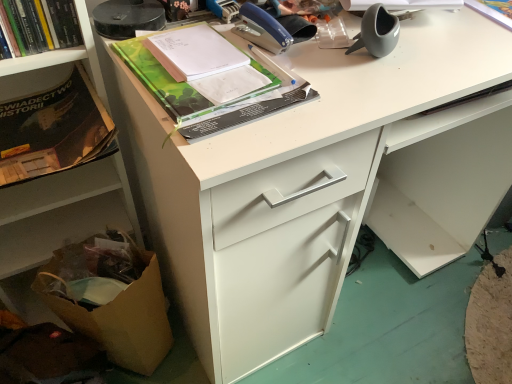
The width and height of the screenshot is (512, 384). Describe the element at coordinates (42, 24) in the screenshot. I see `hardcover book at upper left, which is the 1th book in left-to-right order` at that location.

This screenshot has width=512, height=384. What are the coordinates of `matte black book at left` in the screenshot? It's located at (54, 130).

What do you see at coordinates (203, 96) in the screenshot? This screenshot has width=512, height=384. I see `green matte book at upper center, acting as the 2th book starting from the right` at bounding box center [203, 96].

The width and height of the screenshot is (512, 384). In order to click on matte gray vase at upper right, the 1th office supplies positioned from the right in this screenshot , I will do `click(377, 32)`.

Describe the element at coordinates (110, 299) in the screenshot. This screenshot has width=512, height=384. I see `brown paper bag at lower left` at that location.

The height and width of the screenshot is (384, 512). Identify the location of brown cardboard box at lower left. (63, 212).

Measure the distance between white paper at upper right, which appears as the third book when viewed from the left, and camera.

They are 31.89 inches apart.

Where is `hardcover book at upper left, which is the 1th book in left-to-right order`? The height and width of the screenshot is (384, 512). hardcover book at upper left, which is the 1th book in left-to-right order is located at coordinates (42, 24).

Between blue plastic stapler at upper center, the 1th office supplies positioned from the left, and green matte book at upper center, acting as the 2th book starting from the right, which one appears on the left side from the viewer's perspective?

green matte book at upper center, acting as the 2th book starting from the right.

Is point (244, 15) closer to camera compared to point (282, 100)?

No, (244, 15) is behind (282, 100).

From a real-world perspective, who is located higher, blue plastic stapler at upper center, the 1th office supplies positioned from the left, or green matte book at upper center, the second book when ordered from left to right?

From a 3D spatial view, blue plastic stapler at upper center, the 1th office supplies positioned from the left, is above.

Is blue plastic stapler at upper center, arranged as the second office supplies when viewed from the right, positioned beyond the bounds of green matte book at upper center, the second book when ordered from left to right?

Yes.

Does point (8, 151) come behind point (251, 65)?

Yes, it is.

Is matte black book at left not close to green matte book at upper center, the second book when ordered from left to right?

No, matte black book at left is not far from green matte book at upper center, the second book when ordered from left to right.

Starting from the matte black book at left, which book is the 1st one to the right? Please provide its 2D coordinates.

[(203, 96)]

From a real-world perspective, is matte black book at left positioned above or below green matte book at upper center, the second book when ordered from left to right?

From a real-world perspective, matte black book at left is physically below green matte book at upper center, the second book when ordered from left to right.

In the scene shown: From a real-world perspective, is brown paper bag at lower left physically located above or below white paper at upper right, which appears as the third book when viewed from the left?

From a real-world perspective, brown paper bag at lower left is physically below white paper at upper right, which appears as the third book when viewed from the left.

Is brown paper bag at lower left spatially inside white paper at upper right, which appears as the third book when viewed from the left, or outside of it?

The correct answer is: outside.

Starting from the brown paper bag at lower left, which book is the 2nd one to the right? Please provide its 2D coordinates.

[(494, 10)]

Is brown paper bag at lower left looking in the opposite direction of white paper at upper right, which is the first book from right to left?

No, white paper at upper right, which is the first book from right to left, is not at the back of brown paper bag at lower left.

Measure the distance between matte gray vase at upper right, which is the 2th office supplies in left-to-right order, and green matte book at upper center, acting as the 2th book starting from the right.

matte gray vase at upper right, which is the 2th office supplies in left-to-right order, is 26.19 centimeters away from green matte book at upper center, acting as the 2th book starting from the right.

Which point is more forward, (376, 44) or (257, 118)?

The point (257, 118) is more forward.

In the scene shown: Is matte gray vase at upper right, which is the 2th office supplies in left-to-right order, beside green matte book at upper center, the second book when ordered from left to right?

No.

How different are the orientations of matte gray vase at upper right, which is the 2th office supplies in left-to-right order, and green matte book at upper center, the second book when ordered from left to right, in degrees?

matte gray vase at upper right, which is the 2th office supplies in left-to-right order, and green matte book at upper center, the second book when ordered from left to right, are facing 0.000955 degrees away from each other.

Is hardcover book at upper left, which is the 1th book in left-to-right order, positioned beyond the bounds of white paper at upper right, which appears as the third book when viewed from the left?

Absolutely, hardcover book at upper left, which is the 1th book in left-to-right order, is external to white paper at upper right, which appears as the third book when viewed from the left.

From the image's perspective, is hardcover book at upper left, which is the 1th book in left-to-right order, beneath white paper at upper right, which appears as the third book when viewed from the left?

Indeed, from the image's perspective, hardcover book at upper left, which is the 1th book in left-to-right order, is shown beneath white paper at upper right, which appears as the third book when viewed from the left.

Does hardcover book at upper left, the third book positioned from the right, have a greater width compared to white paper at upper right, which appears as the third book when viewed from the left?

→ Incorrect, the width of hardcover book at upper left, the third book positioned from the right, does not surpass that of white paper at upper right, which appears as the third book when viewed from the left.

Is hardcover book at upper left, which is the 1th book in left-to-right order, placed right next to white paper at upper right, which is the first book from right to left?

No, hardcover book at upper left, which is the 1th book in left-to-right order, is not making contact with white paper at upper right, which is the first book from right to left.

Considering the positions of objects hardcover book at upper left, the third book positioned from the right, and brown cardboard box at lower left in the image provided, who is more to the left, hardcover book at upper left, the third book positioned from the right, or brown cardboard box at lower left?

brown cardboard box at lower left is more to the left.

Is hardcover book at upper left, the third book positioned from the right, aimed at brown cardboard box at lower left?

Yes, hardcover book at upper left, the third book positioned from the right, is aimed at brown cardboard box at lower left.

Could you measure the distance between hardcover book at upper left, the third book positioned from the right, and brown cardboard box at lower left?

hardcover book at upper left, the third book positioned from the right, is 11.74 inches from brown cardboard box at lower left.

Locate an element on the screen. office supplies to the right of blue plastic stapler at upper center, the 1th office supplies positioned from the left is located at coordinates (377, 32).

Is there a large distance between blue plastic stapler at upper center, arranged as the second office supplies when viewed from the right, and matte gray vase at upper right, which is the 2th office supplies in left-to-right order?

No, blue plastic stapler at upper center, arranged as the second office supplies when viewed from the right, is not far from matte gray vase at upper right, which is the 2th office supplies in left-to-right order.

Considering the sizes of blue plastic stapler at upper center, the 1th office supplies positioned from the left, and matte gray vase at upper right, which is the 2th office supplies in left-to-right order, in the image, is blue plastic stapler at upper center, the 1th office supplies positioned from the left, bigger or smaller than matte gray vase at upper right, which is the 2th office supplies in left-to-right order,?

blue plastic stapler at upper center, the 1th office supplies positioned from the left, is smaller than matte gray vase at upper right, which is the 2th office supplies in left-to-right order.

From the picture: Is blue plastic stapler at upper center, arranged as the second office supplies when viewed from the right, shorter than matte gray vase at upper right, which is the 2th office supplies in left-to-right order?

Yes, blue plastic stapler at upper center, arranged as the second office supplies when viewed from the right, is shorter than matte gray vase at upper right, which is the 2th office supplies in left-to-right order.

From the blue plastic stapler at upper center, arranged as the second office supplies when viewed from the right, count the 1st book to the left and point to it. Please provide its 2D coordinates.

[(203, 96)]

You are a GUI agent. You are given a task and a screenshot of the screen. Output one action in this format:
    pyautogui.click(x=<x>, y=<y>)
    Task: Click on the 2nd book in front of the matte black book at left
    The width and height of the screenshot is (512, 384).
    Given the screenshot: What is the action you would take?
    pyautogui.click(x=203, y=96)

From the image, which object appears to be nearer to hardcover book at upper left, the third book positioned from the right, brown cardboard box at lower left or green matte book at upper center, the second book when ordered from left to right?

The object closer to hardcover book at upper left, the third book positioned from the right, is green matte book at upper center, the second book when ordered from left to right.

Consider the image. Which object lies further to the anchor point brown paper bag at lower left, blue plastic stapler at upper center, the 1th office supplies positioned from the left, or green matte book at upper center, acting as the 2th book starting from the right?

blue plastic stapler at upper center, the 1th office supplies positioned from the left, is positioned further to the anchor brown paper bag at lower left.

Estimate the real-world distances between objects in this image. Which object is further from blue plastic stapler at upper center, the 1th office supplies positioned from the left, white paper at upper right, which is the first book from right to left, or matte black book at left?

white paper at upper right, which is the first book from right to left, is further to blue plastic stapler at upper center, the 1th office supplies positioned from the left.

From the image, which object appears to be farther from white paper at upper right, which appears as the third book when viewed from the left, hardcover book at upper left, which is the 1th book in left-to-right order, or green matte book at upper center, the second book when ordered from left to right?

hardcover book at upper left, which is the 1th book in left-to-right order.

Based on their spatial positions, is matte black book at left or brown paper bag at lower left further from green matte book at upper center, the second book when ordered from left to right?

brown paper bag at lower left lies further to green matte book at upper center, the second book when ordered from left to right, than the other object.

When comparing their distances from matte gray vase at upper right, the 1th office supplies positioned from the right, does brown paper bag at lower left or hardcover book at upper left, the third book positioned from the right, seem closer?

hardcover book at upper left, the third book positioned from the right.

Considering their positions, is white paper at upper right, which appears as the third book when viewed from the left, positioned closer to blue plastic stapler at upper center, arranged as the second office supplies when viewed from the right, than green matte book at upper center, the second book when ordered from left to right?

green matte book at upper center, the second book when ordered from left to right.

Considering their positions, is matte gray vase at upper right, the 1th office supplies positioned from the right, positioned further to white paper at upper right, which is the first book from right to left, than green matte book at upper center, the second book when ordered from left to right?

The object further to white paper at upper right, which is the first book from right to left, is green matte book at upper center, the second book when ordered from left to right.

Locate an element on the screen. This screenshot has height=384, width=512. book between matte black book at left and matte gray vase at upper right, which is the 2th office supplies in left-to-right order is located at coordinates (203, 96).

You are a GUI agent. You are given a task and a screenshot of the screen. Output one action in this format:
    pyautogui.click(x=<x>, y=<y>)
    Task: Click on the cardboard box between hardcover book at upper left, the third book positioned from the right, and matte gray vase at upper right, the 1th office supplies positioned from the right
    
    Given the screenshot: What is the action you would take?
    pyautogui.click(x=110, y=299)

Find the location of `office supplies between matte black book at left and matte gray vase at upper right, which is the 2th office supplies in left-to-right order, from left to right`. office supplies between matte black book at left and matte gray vase at upper right, which is the 2th office supplies in left-to-right order, from left to right is located at coordinates (272, 29).

At what (x,y) coordinates should I click in order to perform the action: click on cabinetry between matte black book at left and brown paper bag at lower left from top to bottom. Please return your answer as a coordinate pair (x, y). The image size is (512, 384). Looking at the image, I should click on coord(63,212).